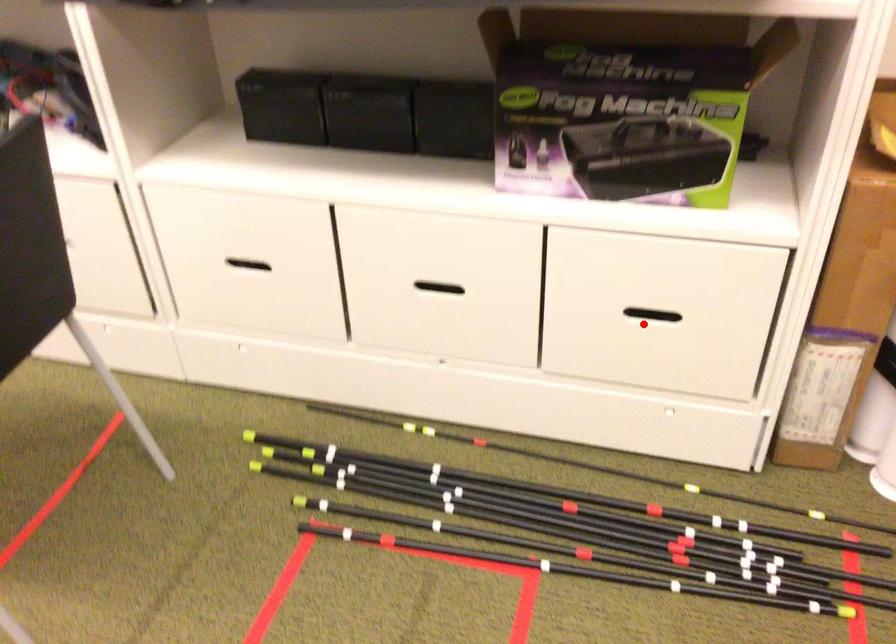
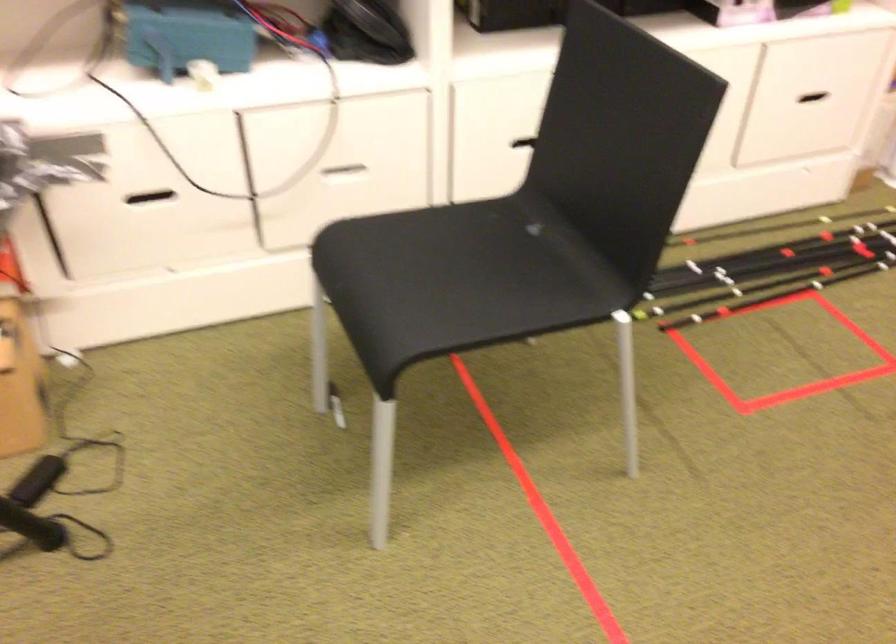
Question: A red point is marked in image1. In image2, is the corresponding 3D point closer to the camera or farther? Reply with the corresponding letter.

Choices:
 (A) The corresponding 3D point is closer.
 (B) The corresponding 3D point is farther.

Answer: (B)